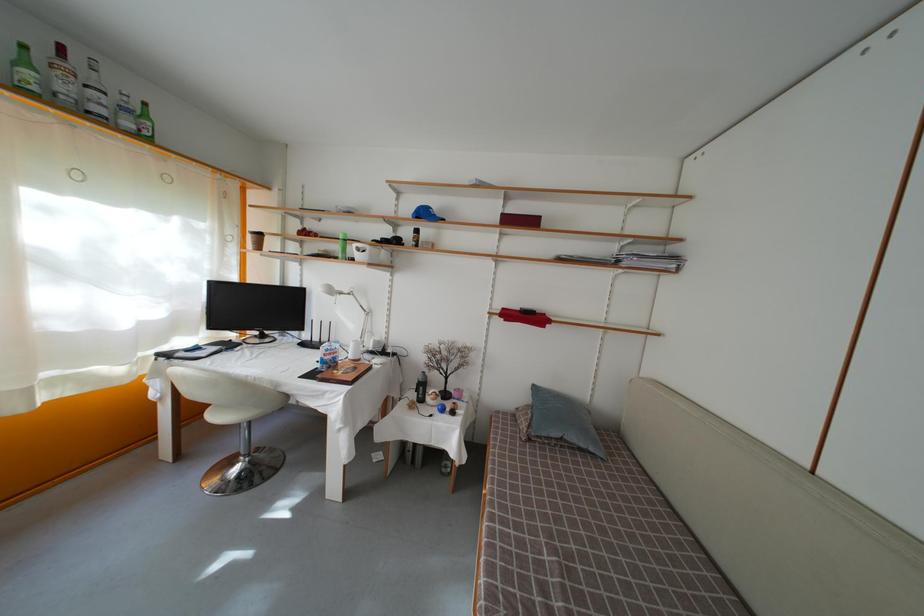
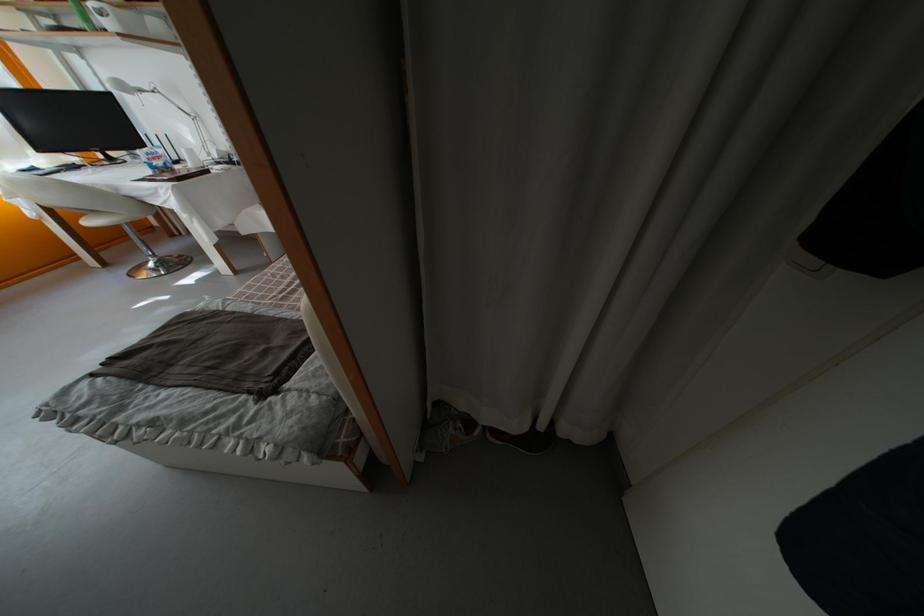
Locate, in the second image, the point that corresponds to (337,358) in the first image.

(160, 161)